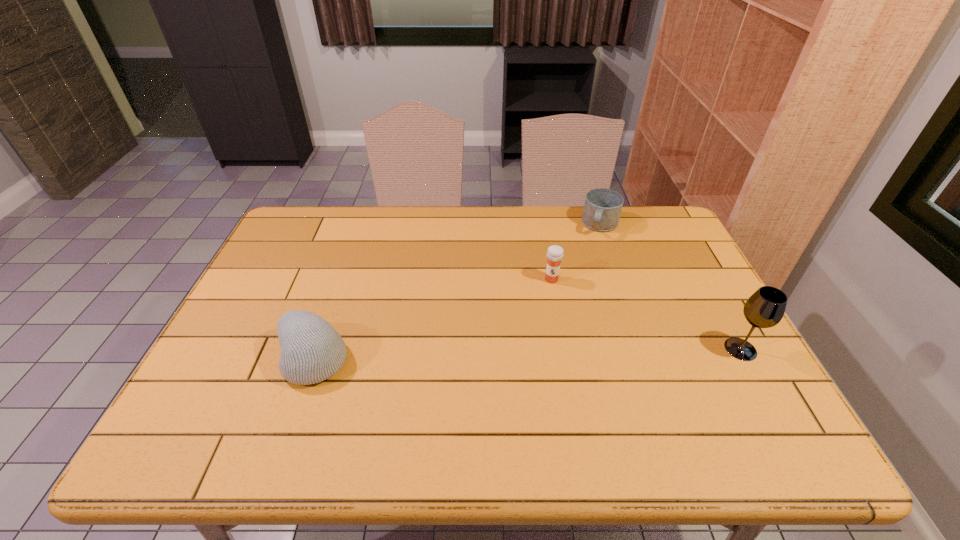
Find the location of a particular element. blank space that satisfies the following two spatial constraints: 1. on the back side of the tallest object; 2. on the right side of the leftmost object is located at coordinates (317, 349).